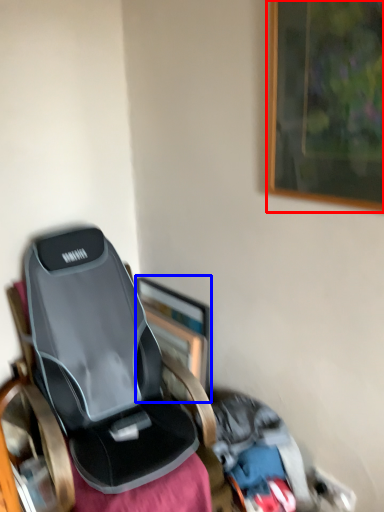
Question: Among these objects, which one is nearest to the camera, picture frame (highlighted by a red box) or picture frame (highlighted by a blue box)?

Choices:
 (A) picture frame
 (B) picture frame

Answer: (A)